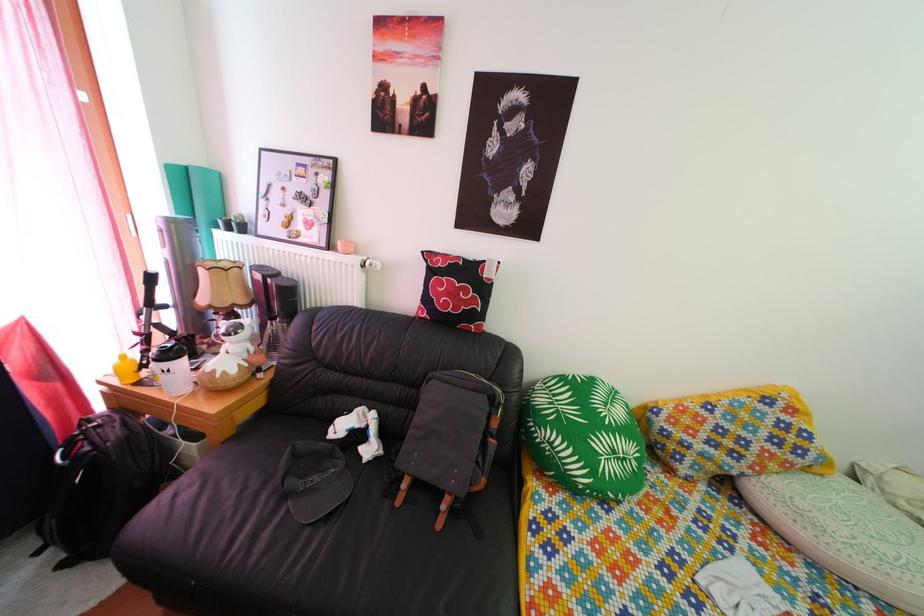
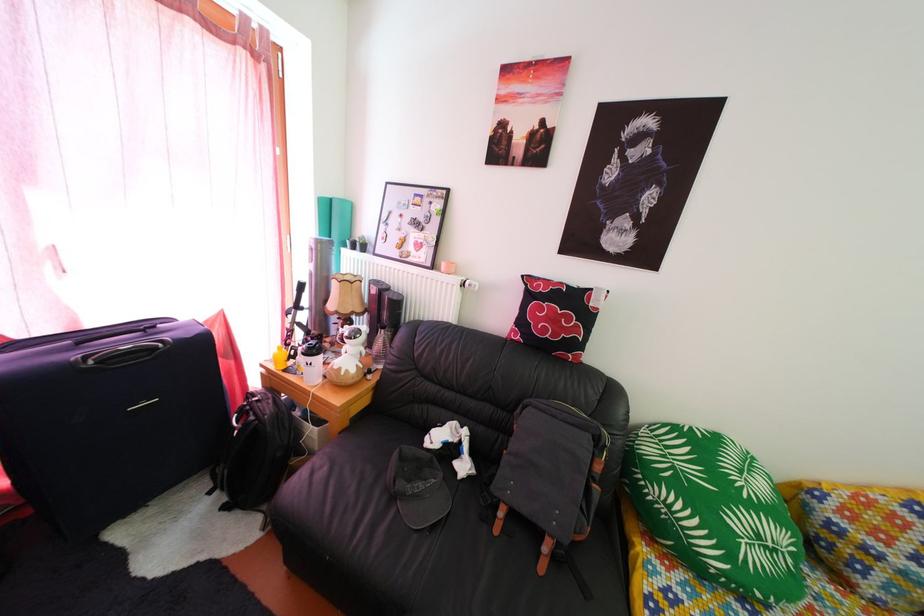
In the second image, find the point that corresponds to the point at 363,262 in the first image.

(464, 282)